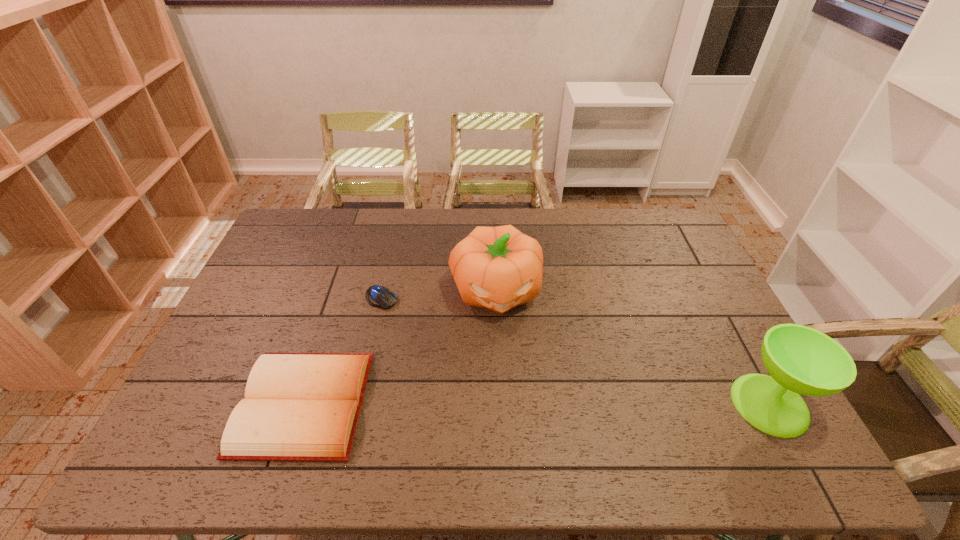
This screenshot has height=540, width=960. In the image, there is a desktop. Find the location of `free region at the left edge`. free region at the left edge is located at coordinates (239, 390).

Locate an element on the screen. vacant space at the right edge of the desktop is located at coordinates (680, 262).

In the image, there is a desktop. Where is `free space at the far left corner`? free space at the far left corner is located at coordinates (296, 230).

You are a GUI agent. You are given a task and a screenshot of the screen. Output one action in this format:
    pyautogui.click(x=<x>, y=<y>)
    Task: Click on the blank space at the far right corner of the desktop
    The image size is (960, 540).
    Given the screenshot: What is the action you would take?
    pyautogui.click(x=661, y=243)

The height and width of the screenshot is (540, 960). I want to click on blank region between the shortest object and the wineglass, so click(575, 352).

At what (x,y) coordinates should I click in order to perform the action: click on unoccupied area between the computer mouse and the second object from right to left. Please return your answer as a coordinate pair (x, y). This screenshot has width=960, height=540. Looking at the image, I should click on [x=439, y=294].

You are a GUI agent. You are given a task and a screenshot of the screen. Output one action in this format:
    pyautogui.click(x=<x>, y=<y>)
    Task: Click on the unoccupied position between the wineglass and the shortest object
    The height and width of the screenshot is (540, 960).
    Given the screenshot: What is the action you would take?
    pyautogui.click(x=575, y=352)

Where is `vacant space in between the second shortest object and the rightmost object`? The width and height of the screenshot is (960, 540). vacant space in between the second shortest object and the rightmost object is located at coordinates (537, 404).

The height and width of the screenshot is (540, 960). Identify the location of free space between the pumpkin and the wineglass. (x=633, y=347).

I want to click on free space between the Bible and the second object from right to left, so click(x=399, y=347).